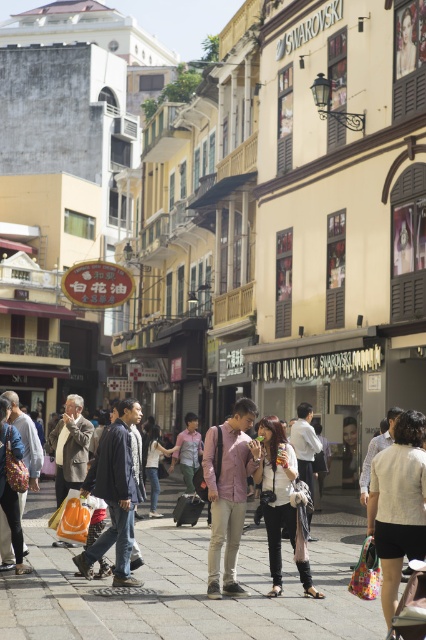
Question: Which object appears farthest from the camera in this image?

Choices:
 (A) matte black jacket at center
 (B) dark blue denim jacket at center
 (C) light pink fabric shirt at center
 (D) smooth stone pavement at center

Answer: (C)

Question: Does smooth stone pavement at center have a greater width compared to pink fabric shirt at center?

Choices:
 (A) yes
 (B) no

Answer: (A)

Question: Can you confirm if white textured shirt at center is positioned above pink fabric shirt at center?

Choices:
 (A) yes
 (B) no

Answer: (A)

Question: Is white textured shirt at center further to the viewer compared to pink fabric shirt at center?

Choices:
 (A) no
 (B) yes

Answer: (A)

Question: Which object is the farthest from the white textured shirt at center?

Choices:
 (A) matte black jacket at center
 (B) dark blue denim jacket at center
 (C) smooth stone pavement at center

Answer: (C)

Question: Which object appears farthest from the camera in this image?

Choices:
 (A) dark blue denim jacket at center
 (B) light pink fabric shirt at center
 (C) pink fabric shirt at center

Answer: (B)